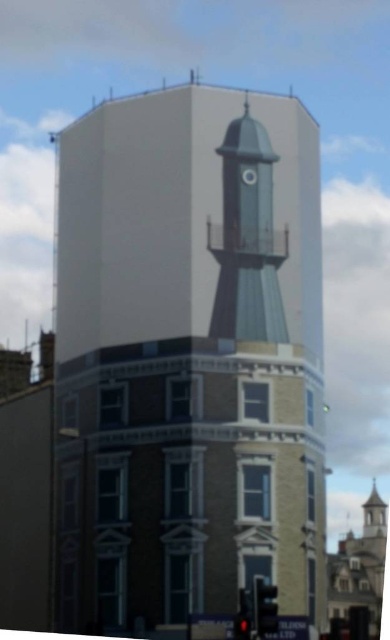
You are a pedestrian standing on the sidewalk in front of the modern and traditional building. You notice two traffic lights at lower center. Which traffic light is closer to you, the matte black traffic light at lower center or the red glass traffic light at lower center?

The matte black traffic light at lower center is closer to you because it is further to the viewer than the red glass traffic light at lower center.